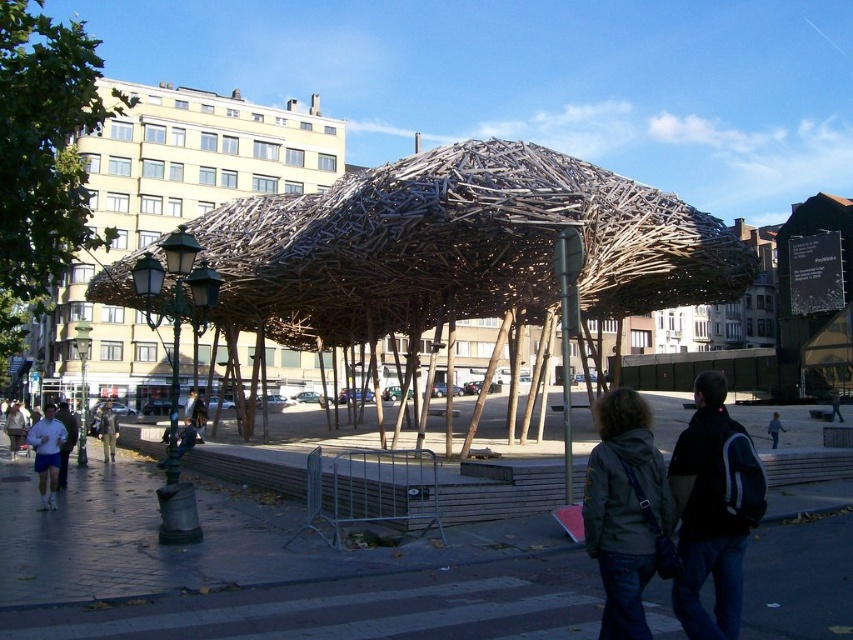
Question: Is green leafy tree at upper left thinner than black backpack at lower right?

Choices:
 (A) no
 (B) yes

Answer: (A)

Question: Which object is the farthest from the natural wood umbrella at center?

Choices:
 (A) black backpack at lower right
 (B) denim jacket at lower right

Answer: (A)

Question: Among these points, which one is farthest from the camera?

Choices:
 (A) (65, 476)
 (B) (20, 49)
 (C) (601, 400)

Answer: (A)

Question: Does natural wood umbrella at center lie in front of dark gray jacket at lower left?

Choices:
 (A) no
 (B) yes

Answer: (A)

Question: Which is farther from the green leafy tree at upper left?

Choices:
 (A) dark blue jeans at center
 (B) black backpack at lower right

Answer: (B)

Question: Where is dark blue jeans at center located in relation to light blue jeans at lower right in the image?

Choices:
 (A) left
 (B) right

Answer: (A)